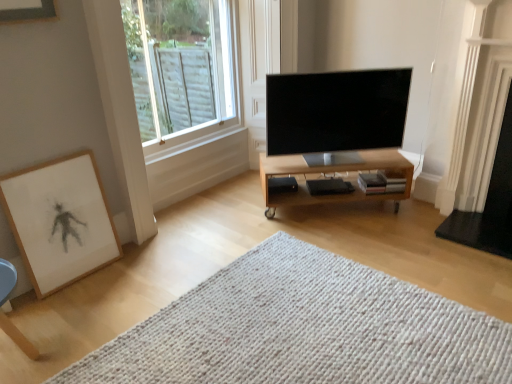
This screenshot has width=512, height=384. Identify the location of empty space that is in between light wood/finished table at center and white glossy fireplace at right. (392, 223).